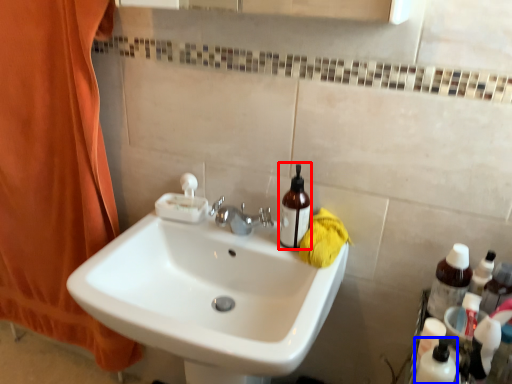
Question: Which point is further to the camera, mouthwash (highlighted by a red box) or toiletry (highlighted by a blue box)?

Choices:
 (A) mouthwash
 (B) toiletry

Answer: (A)